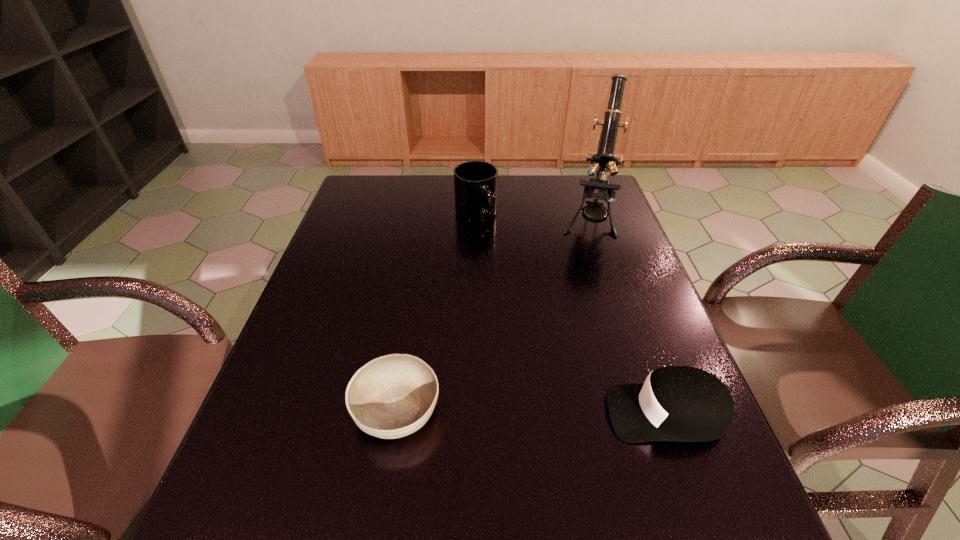
Image resolution: width=960 pixels, height=540 pixels. Identify the location of free point between the second tallest object and the third tallest object. (571, 314).

At what (x,y) coordinates should I click in order to perform the action: click on vacant area that lies between the tallest object and the third tallest object. Please return your answer as a coordinate pair (x, y). The width and height of the screenshot is (960, 540). Looking at the image, I should click on (627, 318).

Where is `empty location between the microscope and the cap`? The image size is (960, 540). empty location between the microscope and the cap is located at coordinates (627, 318).

Where is `free space between the second shortest object and the second tallest object`? The width and height of the screenshot is (960, 540). free space between the second shortest object and the second tallest object is located at coordinates (571, 314).

Where is `unoccupied position between the second shortest object and the shortest object`? unoccupied position between the second shortest object and the shortest object is located at coordinates (531, 411).

Where is `free space between the cap and the mug`? free space between the cap and the mug is located at coordinates (571, 314).

Locate an element on the screen. The image size is (960, 540). vacant space that is in between the shortest object and the tallest object is located at coordinates (492, 316).

This screenshot has width=960, height=540. In order to click on object identified as the closest to the tallest object in this screenshot , I will do `click(475, 182)`.

This screenshot has height=540, width=960. I want to click on object that stands as the third closest to the microscope, so click(392, 396).

Image resolution: width=960 pixels, height=540 pixels. Find the location of `vacant space that satisfies the following two spatial constraints: 1. on the front side of the second shortest object; 2. on the front-facing side of the shortest object`. vacant space that satisfies the following two spatial constraints: 1. on the front side of the second shortest object; 2. on the front-facing side of the shortest object is located at coordinates click(396, 413).